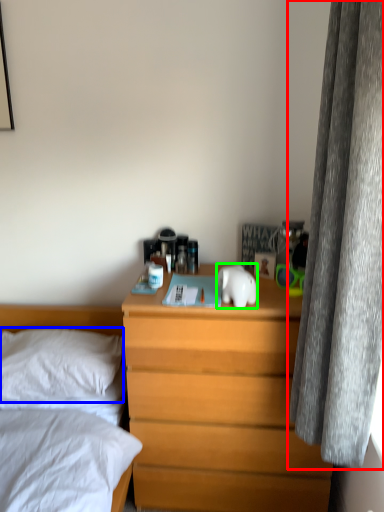
Question: Which object is the closest to the curtain (highlighted by a red box)? Choose among these: pillow (highlighted by a blue box) or animal (highlighted by a green box).

Choices:
 (A) pillow
 (B) animal

Answer: (B)